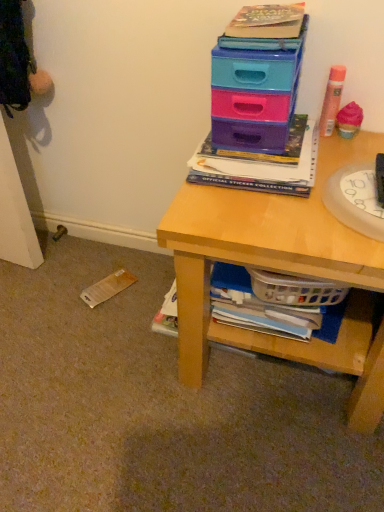
Question: Considering their positions, is matte plastic drawers at upper right located in front of or behind wooden desk at upper right?

Choices:
 (A) behind
 (B) front

Answer: (A)

Question: Considering the positions of matte plastic drawers at upper right and wooden desk at upper right in the image, is matte plastic drawers at upper right wider or thinner than wooden desk at upper right?

Choices:
 (A) wide
 (B) thin

Answer: (B)

Question: Estimate the real-world distances between objects in this image. Which object is closer to the transparent plastic plate at right?

Choices:
 (A) hardcover book at upper center
 (B) matte plastic drawers at upper right
 (C) pink matte hair spray at upper right
 (D) wooden desk at upper right

Answer: (A)

Question: Considering the real-world distances, which object is closest to the wooden desk at upper right?

Choices:
 (A) matte plastic drawers at upper right
 (B) transparent plastic plate at right
 (C) pink matte hair spray at upper right
 (D) hardcover book at upper center

Answer: (D)